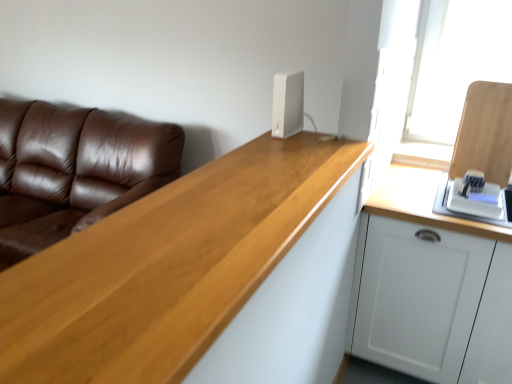
You are a GUI agent. You are given a task and a screenshot of the screen. Output one action in this format:
    pyautogui.click(x=<x>, y=<y>)
    Task: Click on the empty space that is ontop of light wood countertop at center (from a real-world perspective)
    The width and height of the screenshot is (512, 384).
    Given the screenshot: What is the action you would take?
    165,231